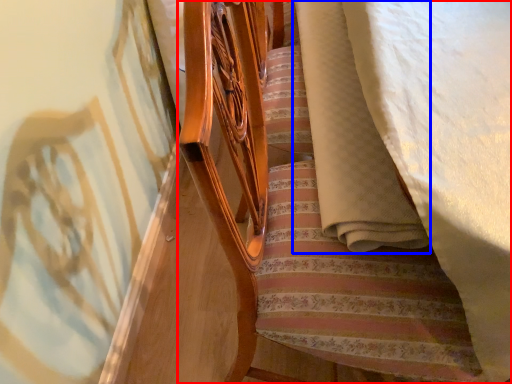
Question: Which object appears closest to the camera in this image, furniture (highlighted by a red box) or blanket (highlighted by a blue box)?

Choices:
 (A) furniture
 (B) blanket

Answer: (A)